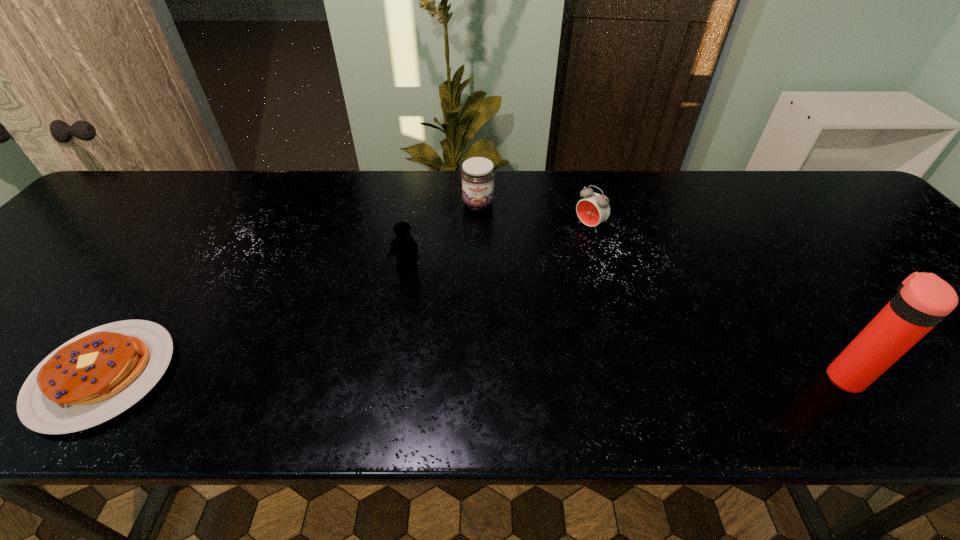
Where is `free space located on the front-facing side of the Lego`? This screenshot has width=960, height=540. free space located on the front-facing side of the Lego is located at coordinates (380, 355).

This screenshot has width=960, height=540. Find the location of `free region located 0.050m on the front-facing side of the Lego`. free region located 0.050m on the front-facing side of the Lego is located at coordinates (399, 290).

Find the location of a particular element. vacant space located on the front label of the farthest object is located at coordinates click(482, 242).

Find the location of a particular element. Image resolution: width=960 pixels, height=540 pixels. free space located 0.240m on the front label of the farthest object is located at coordinates (485, 275).

The image size is (960, 540). I want to click on blank area located on the front label of the farthest object, so click(489, 314).

I want to click on vacant region located on the face of the second farthest object, so click(528, 269).

Identify the location of free space located on the face of the second farthest object. Image resolution: width=960 pixels, height=540 pixels. (528, 269).

Identify the location of free space located on the face of the second farthest object. This screenshot has height=540, width=960. (467, 313).

Where is `jam present at the far edge`? jam present at the far edge is located at coordinates (477, 175).

Identify the location of alarm clock that is at the far edge. The height and width of the screenshot is (540, 960). (593, 209).